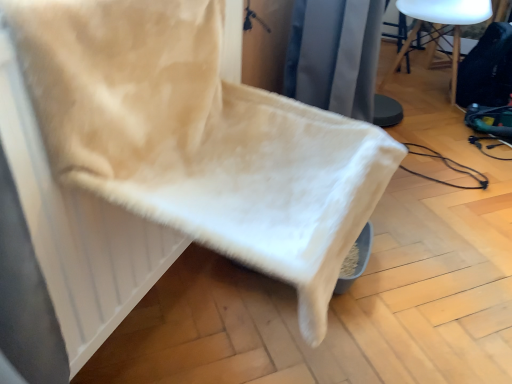
Measure the distance between point (x=446, y=8) and camera.

Point (x=446, y=8) is 2.05 meters from camera.

What do you see at coordinates (442, 14) in the screenshot? I see `black fabric chair at upper right` at bounding box center [442, 14].

Where is `black fabric chair at upper right`? black fabric chair at upper right is located at coordinates (442, 14).

This screenshot has width=512, height=384. What do you see at coordinates (200, 139) in the screenshot?
I see `white fluffy blanket at lower left` at bounding box center [200, 139].

Find the location of a particular element. The width and height of the screenshot is (512, 384). white fluffy blanket at lower left is located at coordinates tap(200, 139).

Image resolution: width=512 pixels, height=384 pixels. Identify the location of black fabric chair at upper right. (442, 14).

Can you confirm if black fabric chair at upper right is positioned to the left of white fluffy blanket at lower left?

No, black fabric chair at upper right is not to the left of white fluffy blanket at lower left.

Does black fabric chair at upper right come behind white fluffy blanket at lower left?

Yes, black fabric chair at upper right is further from the viewer.

Considering the positions of points (399, 9) and (281, 170), is point (399, 9) closer to camera compared to point (281, 170)?

No.

From the image's perspective, does black fabric chair at upper right appear lower than white fluffy blanket at lower left?

Incorrect, from the image's perspective, black fabric chair at upper right is higher than white fluffy blanket at lower left.

From a real-world perspective, who is located lower, black fabric chair at upper right or white fluffy blanket at lower left?

In real-world perspective, black fabric chair at upper right is lower.

Considering the sizes of objects black fabric chair at upper right and white fluffy blanket at lower left in the image provided, who is wider, black fabric chair at upper right or white fluffy blanket at lower left?

white fluffy blanket at lower left.

Considering the sizes of objects black fabric chair at upper right and white fluffy blanket at lower left in the image provided, who is taller, black fabric chair at upper right or white fluffy blanket at lower left?

Standing taller between the two is black fabric chair at upper right.

Who is bigger, black fabric chair at upper right or white fluffy blanket at lower left?

Bigger between the two is black fabric chair at upper right.

Is black fabric chair at upper right inside the boundaries of white fluffy blanket at lower left, or outside?

black fabric chair at upper right is outside white fluffy blanket at lower left.

Would you consider black fabric chair at upper right to be distant from white fluffy blanket at lower left?

Yes, black fabric chair at upper right and white fluffy blanket at lower left are located far from each other.

Does black fabric chair at upper right turn towards white fluffy blanket at lower left?

Yes, black fabric chair at upper right is facing white fluffy blanket at lower left.

What's the angular difference between black fabric chair at upper right and white fluffy blanket at lower left's facing directions?

black fabric chair at upper right and white fluffy blanket at lower left are facing 87.4 degrees away from each other.

Locate an element on the screen. Image resolution: width=512 pixels, height=384 pixels. chair on the left of black fabric chair at upper right is located at coordinates click(x=200, y=139).

Which object is positioned more to the right, white fluffy blanket at lower left or black fabric chair at upper right?

Positioned to the right is black fabric chair at upper right.

Is white fluffy blanket at lower left further to camera compared to black fabric chair at upper right?

No, white fluffy blanket at lower left is closer to the viewer.

Considering the points (399, 153) and (434, 2), which point is in front, point (399, 153) or point (434, 2)?

Positioned in front is point (399, 153).

From the image's perspective, between white fluffy blanket at lower left and black fabric chair at upper right, which one is located above?

black fabric chair at upper right.

From a real-world perspective, does white fluffy blanket at lower left sit lower than black fabric chair at upper right?

No.

Consider the image. Does white fluffy blanket at lower left have a greater width compared to black fabric chair at upper right?

Correct, the width of white fluffy blanket at lower left exceeds that of black fabric chair at upper right.

Between white fluffy blanket at lower left and black fabric chair at upper right, which one has less height?

Standing shorter between the two is white fluffy blanket at lower left.

Looking at the image, does white fluffy blanket at lower left seem bigger or smaller compared to black fabric chair at upper right?

white fluffy blanket at lower left is smaller than black fabric chair at upper right.

Is white fluffy blanket at lower left positioned beyond the bounds of black fabric chair at upper right?

Yes, white fluffy blanket at lower left is outside of black fabric chair at upper right.

Is white fluffy blanket at lower left placed right next to black fabric chair at upper right?

white fluffy blanket at lower left is not next to black fabric chair at upper right, and they're not touching.

Is white fluffy blanket at lower left oriented towards black fabric chair at upper right?

No, white fluffy blanket at lower left is not oriented towards black fabric chair at upper right.

What's the angular difference between white fluffy blanket at lower left and black fabric chair at upper right's facing directions?

The angular difference between white fluffy blanket at lower left and black fabric chair at upper right is 87.4 degrees.

Measure the distance between white fluffy blanket at lower left and black fabric chair at upper right.

white fluffy blanket at lower left is 1.67 meters away from black fabric chair at upper right.

Identify the location of furniture on the right of white fluffy blanket at lower left. (442, 14).

The image size is (512, 384). What are the coordinates of `chair on the left side of black fabric chair at upper right` in the screenshot? It's located at (200, 139).

At what (x,y) coordinates should I click in order to perform the action: click on chair in front of the black fabric chair at upper right. Please return your answer as a coordinate pair (x, y). This screenshot has width=512, height=384. Looking at the image, I should click on (200, 139).